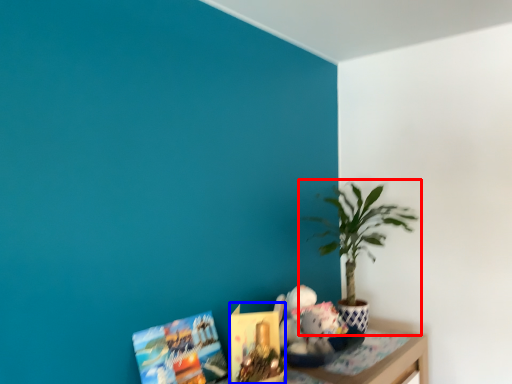
Question: Which point is closer to the camera, houseplant (highlighted by a red box) or book (highlighted by a blue box)?

Choices:
 (A) houseplant
 (B) book

Answer: (B)